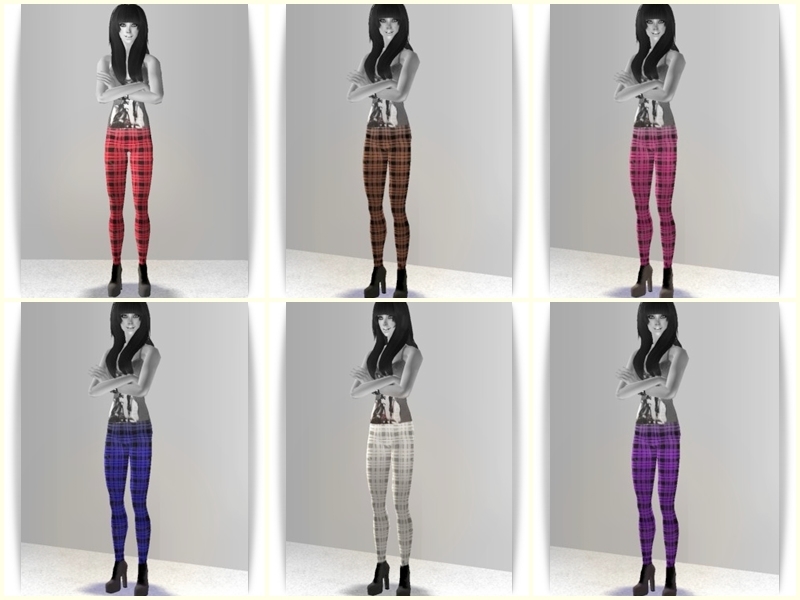
At what (x,y) coordinates should I click in order to perform the action: click on gray wall. Please return your answer as a coordinate pair (x, y). Looking at the image, I should click on (764, 115), (713, 434), (510, 198), (486, 397), (226, 163), (217, 432).